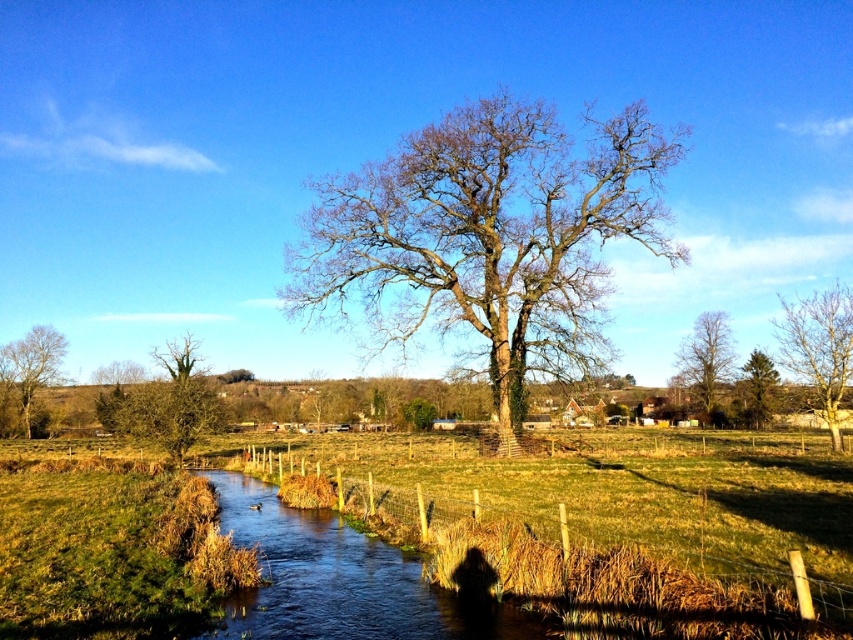
Does bare wood tree at center come in front of green leafy tree at left?

Yes, bare wood tree at center is in front of green leafy tree at left.

Does bare wood tree at center appear on the left side of green leafy tree at left?

In fact, bare wood tree at center is to the right of green leafy tree at left.

Where is `bare wood tree at center`? bare wood tree at center is located at coordinates (486, 237).

Does bare wood tree at center have a larger size compared to bare wood tree at right?

No, bare wood tree at center is not bigger than bare wood tree at right.

Based on the photo, which of these two, bare wood tree at center or bare wood tree at right, stands shorter?

bare wood tree at right

Where is `bare wood tree at center`? The height and width of the screenshot is (640, 853). bare wood tree at center is located at coordinates (486, 237).

Can you confirm if bare wood tree at right is thinner than green leafy tree at left?

In fact, bare wood tree at right might be wider than green leafy tree at left.

Does point (817, 368) come farther from viewer compared to point (27, 362)?

No, (817, 368) is in front of (27, 362).

Describe the element at coordinates (819, 348) in the screenshot. I see `bare wood tree at right` at that location.

Identify the location of bare wood tree at right. The height and width of the screenshot is (640, 853). (819, 348).